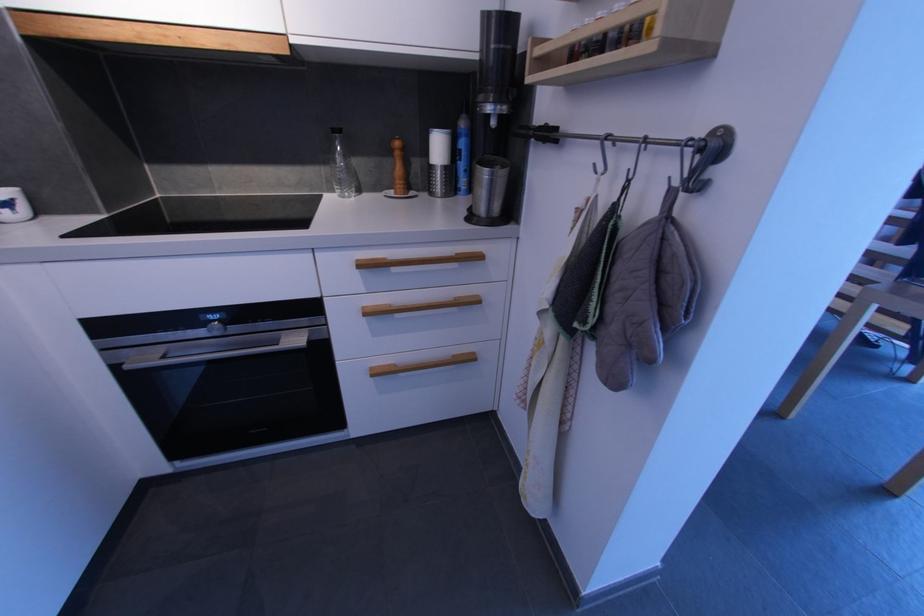
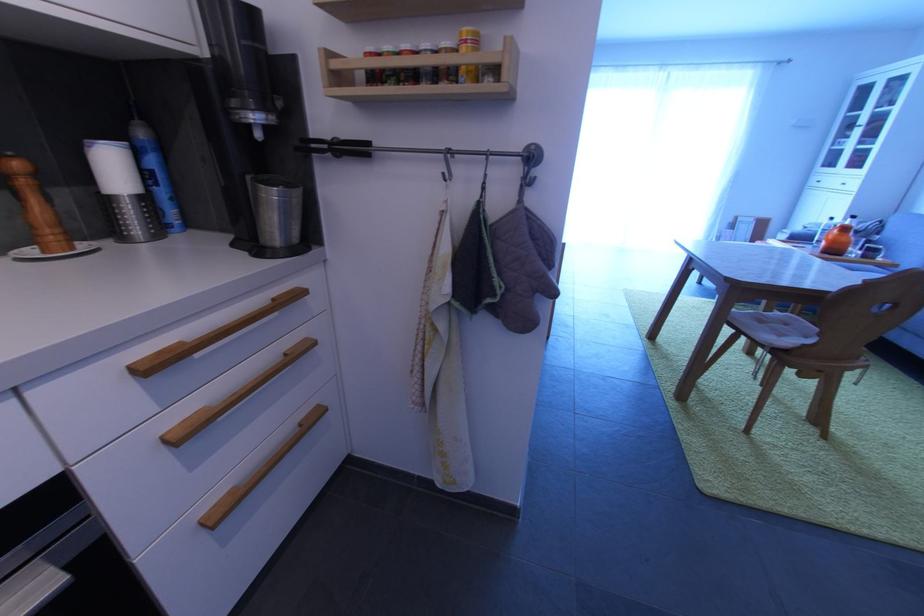
Question: The first image is from the beginning of the video and the second image is from the end. How did the camera likely rotate when shooting the video?

Choices:
 (A) Left
 (B) Right
 (C) Up
 (D) Down

Answer: (B)